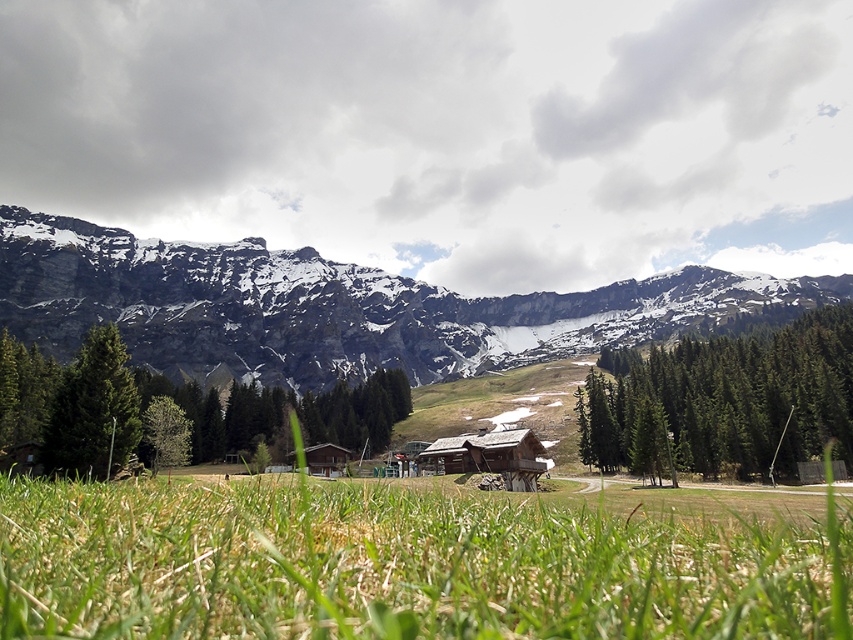
Question: Does snowy granite mountain at left appear over green matte tree at center?

Choices:
 (A) yes
 (B) no

Answer: (A)

Question: Based on their relative distances, which object is farther from the green matte tree at left?

Choices:
 (A) wooden cabin at center
 (B) green grass at center

Answer: (A)

Question: Is green coniferous trees at center positioned in front of green matte tree at left?

Choices:
 (A) no
 (B) yes

Answer: (A)

Question: Based on their relative distances, which object is farther from the green coniferous trees at center?

Choices:
 (A) snowy granite mountain at left
 (B) green leafy tree at lower left

Answer: (B)

Question: Can you confirm if green matte tree at center is positioned below brown wooden cabin at center?

Choices:
 (A) no
 (B) yes

Answer: (A)

Question: Which of the following is the closest to the observer?

Choices:
 (A) click(840, 550)
 (B) click(177, 435)

Answer: (A)